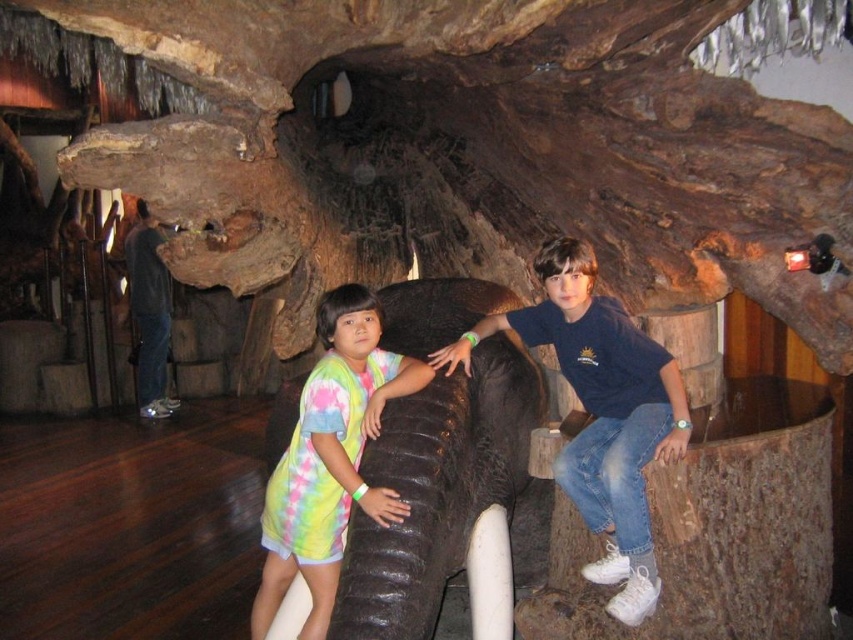
You are standing in the museum exhibit and want to locate the blue cotton shirt at center. Where exactly is it positioned in the scene?

The blue cotton shirt at center is positioned at point coordinates of 0.645 on the x axis and 0.705 on the y axis.